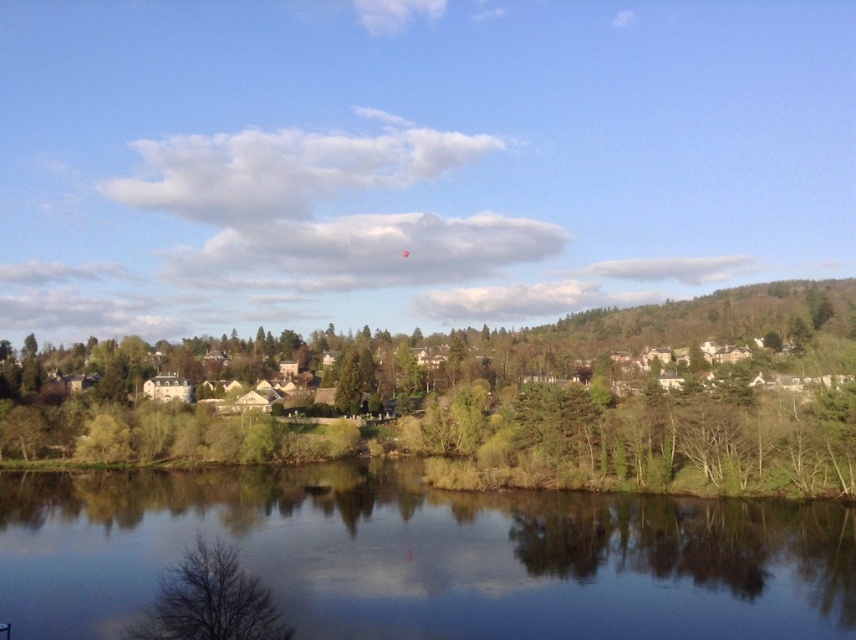
Is green leafy tree at left shorter than transparent water at center?

No, green leafy tree at left is not shorter than transparent water at center.

Between green leafy tree at left and transparent water at center, which one is positioned lower?

Positioned lower is transparent water at center.

Is point (563, 400) closer to viewer compared to point (333, 616)?

No, it is not.

Identify the location of green leafy tree at left. (491, 400).

Which is in front, point (432, 634) or point (244, 602)?

Point (244, 602)

This screenshot has width=856, height=640. What do you see at coordinates (426, 556) in the screenshot?
I see `transparent water at center` at bounding box center [426, 556].

Locate an element on the screen. The height and width of the screenshot is (640, 856). transparent water at center is located at coordinates (426, 556).

What do you see at coordinates (491, 400) in the screenshot?
I see `green leafy tree at left` at bounding box center [491, 400].

Is green leafy tree at left bigger than bare branches at lower left?

Correct, green leafy tree at left is larger in size than bare branches at lower left.

Where is `green leafy tree at left`? green leafy tree at left is located at coordinates (491, 400).